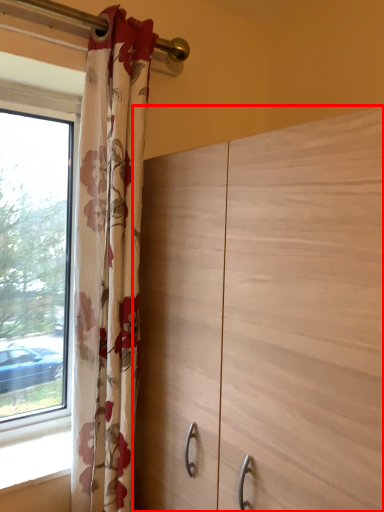
Question: From the image's perspective, what is the correct spatial relationship of dresser (annotated by the red box) in relation to curtain?

Choices:
 (A) above
 (B) below

Answer: (B)